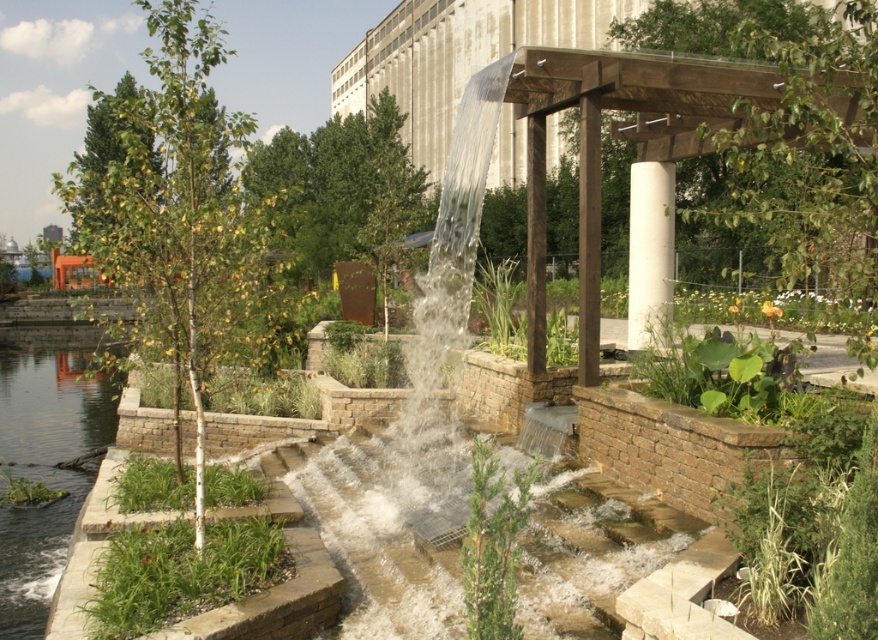
Question: Among these objects, which one is nearest to the camera?

Choices:
 (A) clear water at lower left
 (B) white smooth column at center

Answer: (A)

Question: Is clear water at lower left below white smooth column at center?

Choices:
 (A) no
 (B) yes

Answer: (B)

Question: Is the position of clear water at lower left more distant than that of white smooth column at center?

Choices:
 (A) no
 (B) yes

Answer: (A)

Question: Is clear water at lower left above white smooth column at center?

Choices:
 (A) no
 (B) yes

Answer: (A)